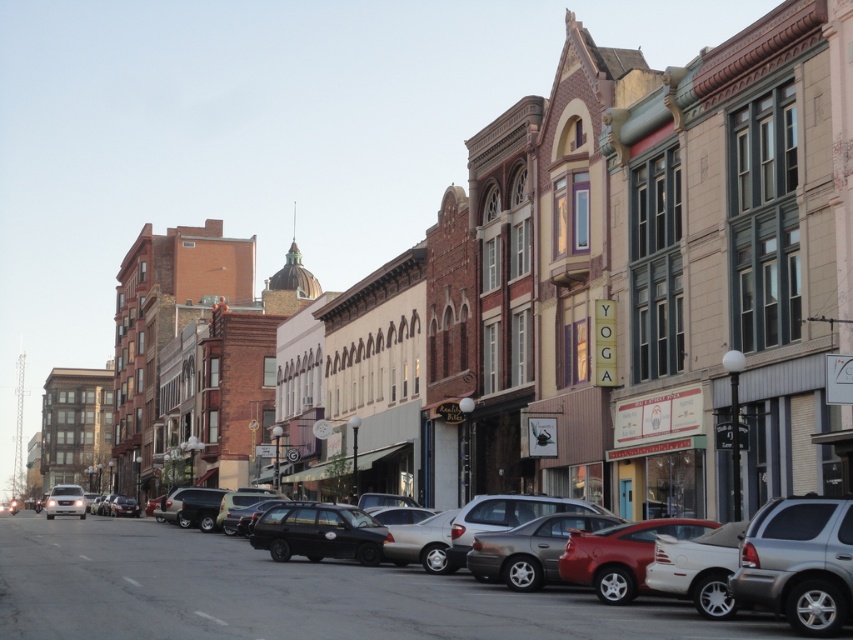
Can you confirm if silver metallic suv at lower right is thinner than shiny red car at center?

Yes.

Does silver metallic suv at lower right have a larger size compared to shiny red car at center?

Incorrect, silver metallic suv at lower right is not larger than shiny red car at center.

The image size is (853, 640). Describe the element at coordinates (799, 563) in the screenshot. I see `silver metallic suv at lower right` at that location.

I want to click on silver metallic suv at lower right, so click(799, 563).

Does point (67, 616) come closer to viewer compared to point (630, 536)?

Yes, point (67, 616) is closer to viewer.

Describe the element at coordinates (286, 593) in the screenshot. I see `black matte sedan at center` at that location.

Where is `black matte sedan at center`? black matte sedan at center is located at coordinates (286, 593).

Is black matte sedan at center to the left of silver metallic suv at lower right from the viewer's perspective?

Indeed, black matte sedan at center is positioned on the left side of silver metallic suv at lower right.

How distant is black matte sedan at center from silver metallic suv at lower right?

black matte sedan at center and silver metallic suv at lower right are 11.96 meters apart.

Is point (239, 602) in front of point (782, 529)?

No, it is not.

Where is `black matte sedan at center`? black matte sedan at center is located at coordinates (286, 593).